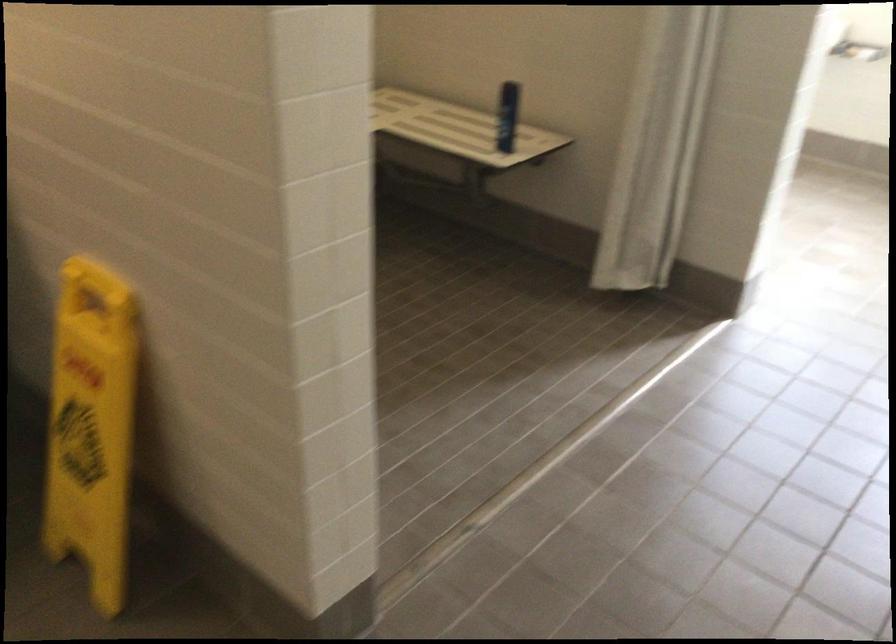
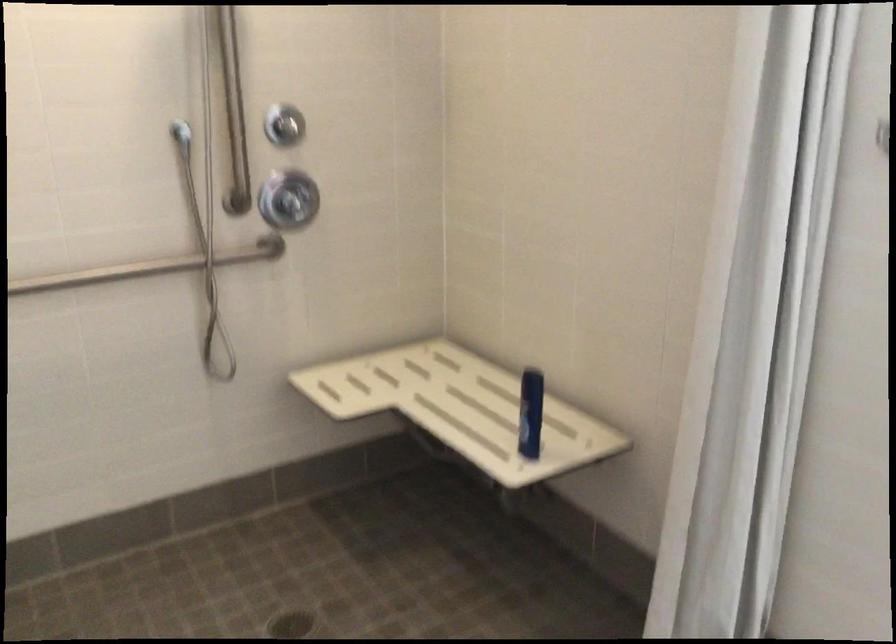
Question: How did the camera likely rotate?

Choices:
 (A) Left
 (B) Right
 (C) Up
 (D) Down

Answer: (A)